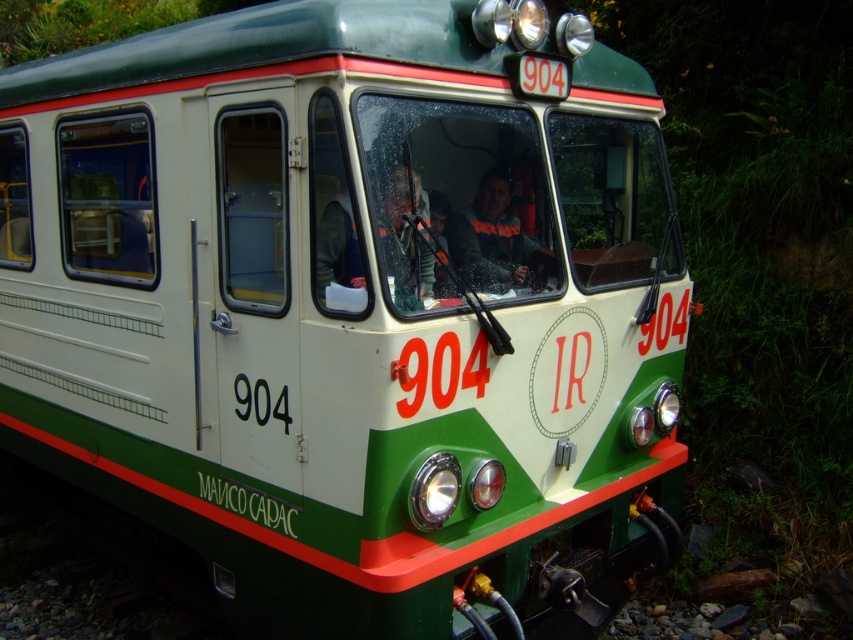
You are a passenger on the train and want to store your jackets properly. You have a matte black jacket at center and a dark gray fabric jacket at center. Which jacket should you place on the upper shelf if you want the taller jacket to be on top?

The dark gray fabric jacket at center is taller than the matte black jacket at center, so you should place the dark gray fabric jacket at center on the upper shelf to have the taller jacket on top.

You are a passenger on the train and want to put your two jackets in the overhead compartment. The matte black jacket at center is lighter than the dark gray fabric jacket at center. Which jacket should you place on top to ensure both fit securely?

You should place the lighter matte black jacket at center on top of the dark gray fabric jacket at center since it is lighter and easier to handle, ensuring both jackets fit securely in the overhead compartment.

You are a photographer standing in front of the train engine marked with the number 904. You want to take a photo of the matte black jacket at center. Where should you position yourself to capture the jacket in the center of your photo?

To capture the matte black jacket at center in the center of your photo, position yourself directly in front of the train engine at the coordinates corresponding to point 0.377 on the horizontal axis and 0.476 on the vertical axis, as this is where the jacket is located.